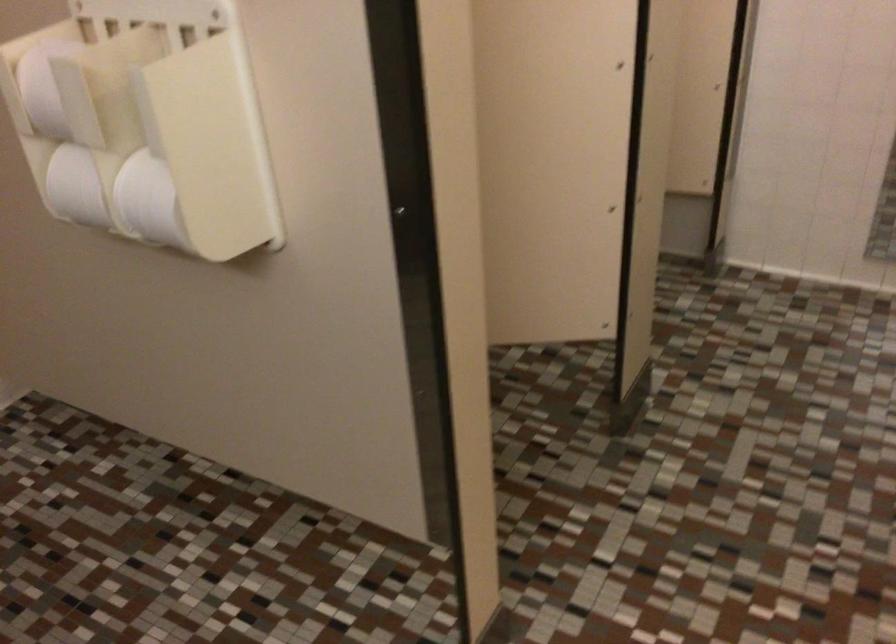
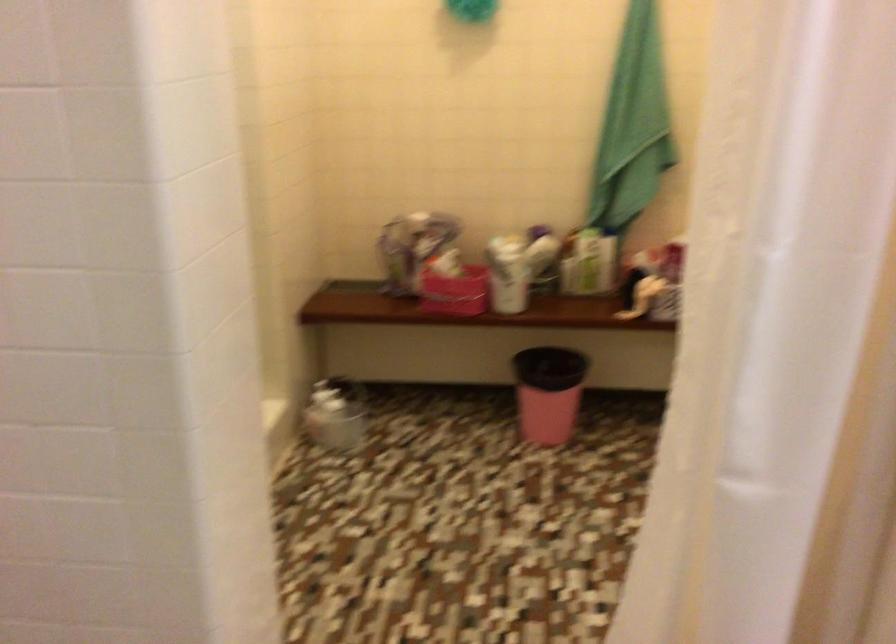
The first image is from the beginning of the video and the second image is from the end. How did the camera likely rotate when shooting the video?

The camera's rotation is toward right-down.